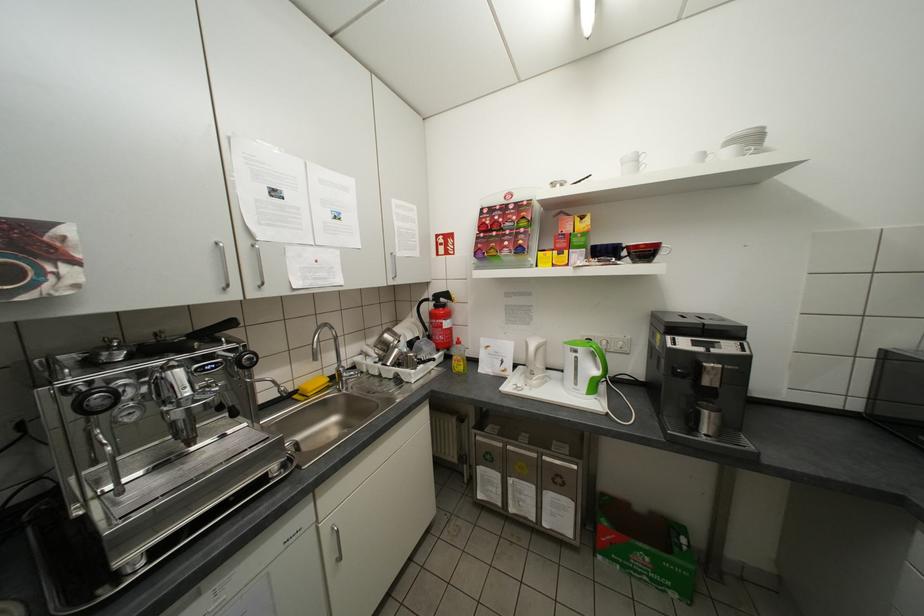
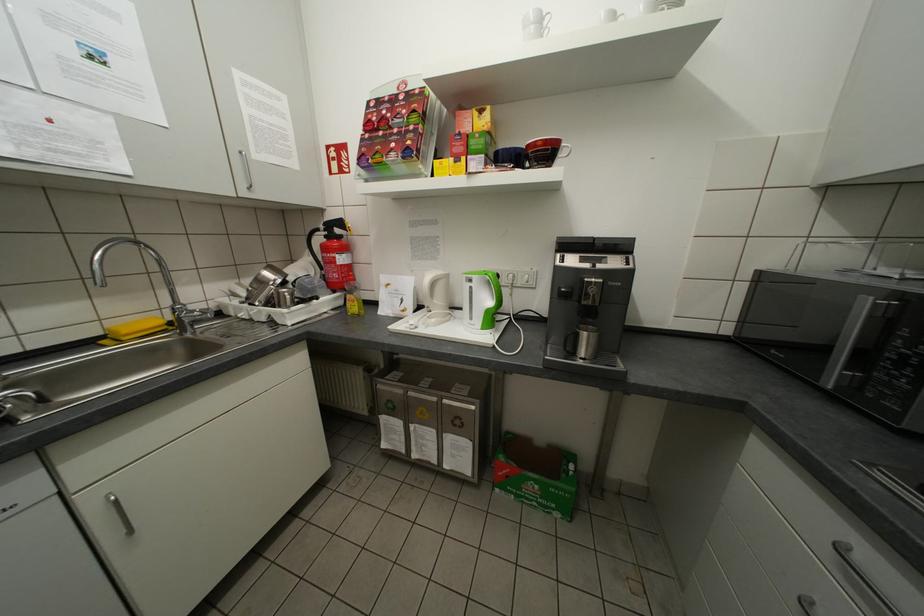
Question: The camera is either moving clockwise (left) or counter-clockwise (right) around the object. The first image is from the beginning of the video and the second image is from the end. Is the camera moving left or right when shooting the video?

Choices:
 (A) Left
 (B) Right

Answer: (A)